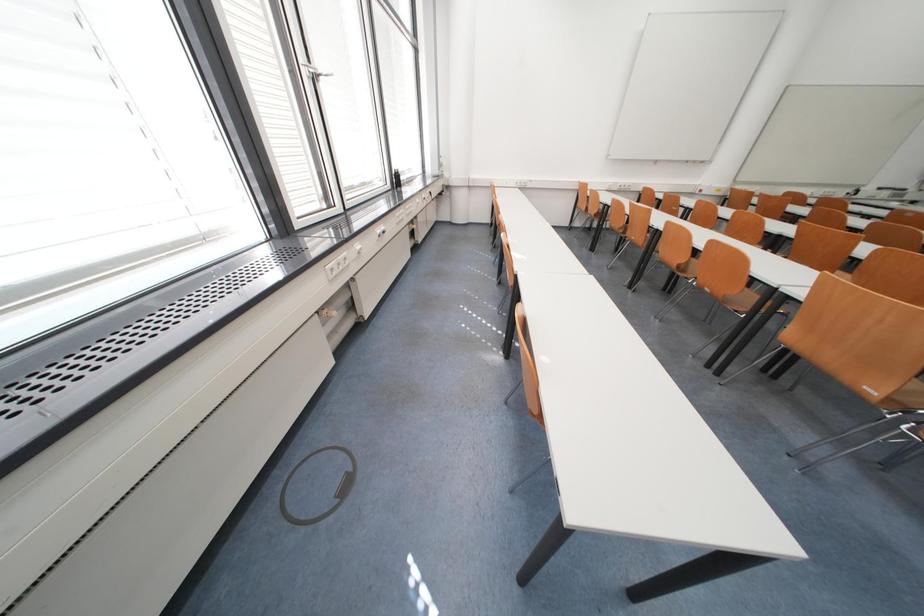
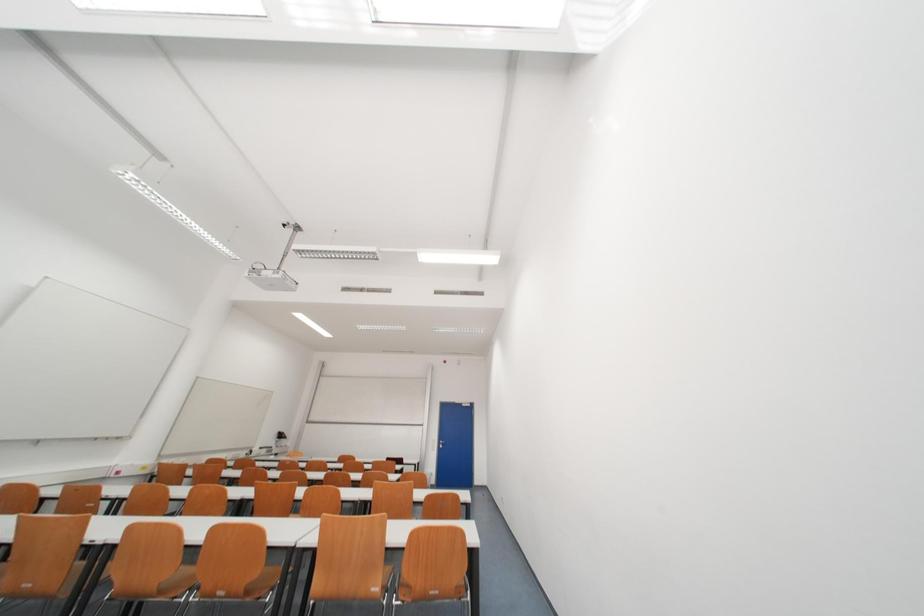
How did the camera likely rotate?

The camera's rotation is toward right-up.